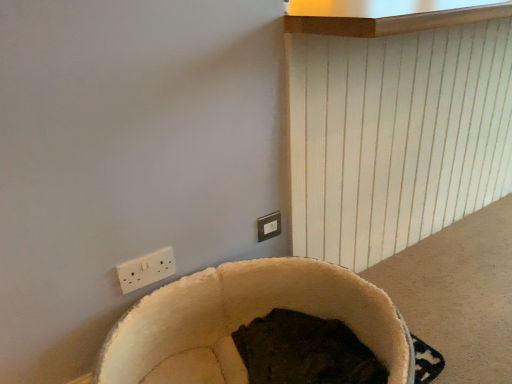
Question: Looking at their shapes, would you say beige plush bean bag chair at lower center is wider or thinner than matte white switch at upper center?

Choices:
 (A) wide
 (B) thin

Answer: (A)

Question: Considering the positions of point (234, 264) and point (279, 226), is point (234, 264) closer or farther from the camera than point (279, 226)?

Choices:
 (A) farther
 (B) closer

Answer: (B)

Question: Which object is positioned closest to the beige plush bean bag chair at lower center?

Choices:
 (A) white plastic power plugs and sockets at lower left
 (B) matte white switch at upper center

Answer: (A)

Question: Which object is positioned closest to the matte white switch at upper center?

Choices:
 (A) beige plush bean bag chair at lower center
 (B) white plastic power plugs and sockets at lower left

Answer: (A)